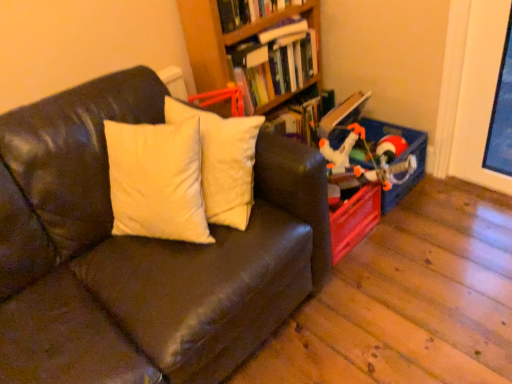
Question: Does hardcover book at upper center, the first book when ordered from top to bottom, have a lesser height compared to hardcover book at upper center, the second book from the top?

Choices:
 (A) no
 (B) yes

Answer: (B)

Question: Is hardcover book at upper center, the 2th book positioned from the bottom, oriented towards hardcover book at upper center, positioned as the first book in bottom-to-top order?

Choices:
 (A) no
 (B) yes

Answer: (A)

Question: From the image's perspective, is hardcover book at upper center, the 2th book positioned from the bottom, on top of hardcover book at upper center, positioned as the first book in bottom-to-top order?

Choices:
 (A) no
 (B) yes

Answer: (B)

Question: Is hardcover book at upper center, the 2th book positioned from the bottom, wider than hardcover book at upper center, positioned as the first book in bottom-to-top order?

Choices:
 (A) no
 (B) yes

Answer: (B)

Question: Are hardcover book at upper center, the 2th book positioned from the bottom, and hardcover book at upper center, positioned as the first book in bottom-to-top order, making contact?

Choices:
 (A) no
 (B) yes

Answer: (A)

Question: Considering the relative sizes of hardcover book at upper center, the first book when ordered from top to bottom, and hardcover book at upper center, positioned as the first book in bottom-to-top order, in the image provided, is hardcover book at upper center, the first book when ordered from top to bottom, bigger than hardcover book at upper center, positioned as the first book in bottom-to-top order,?

Choices:
 (A) yes
 (B) no

Answer: (B)

Question: Is matte plastic toy at right taller than leather couch at left?

Choices:
 (A) no
 (B) yes

Answer: (A)

Question: Does matte plastic toy at right lie in front of leather couch at left?

Choices:
 (A) no
 (B) yes

Answer: (A)

Question: From a real-world perspective, is matte plastic toy at right physically above leather couch at left?

Choices:
 (A) yes
 (B) no

Answer: (B)

Question: From the image's perspective, is matte plastic toy at right above leather couch at left?

Choices:
 (A) yes
 (B) no

Answer: (A)

Question: Is matte plastic toy at right thinner than leather couch at left?

Choices:
 (A) yes
 (B) no

Answer: (A)

Question: Is matte plastic toy at right not inside leather couch at left?

Choices:
 (A) no
 (B) yes

Answer: (B)

Question: Is hardcover book at upper center, the first book when ordered from top to bottom, wider than wooden bookshelf at upper center?

Choices:
 (A) no
 (B) yes

Answer: (B)